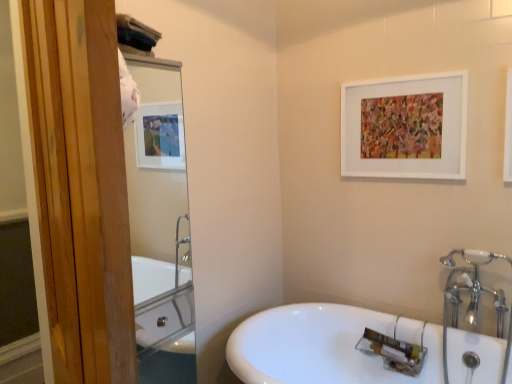
Find the location of a particular element. The height and width of the screenshot is (384, 512). clear glass mirror at upper left is located at coordinates tap(159, 223).

You are a GUI agent. You are given a task and a screenshot of the screen. Output one action in this format:
    pyautogui.click(x=<x>, y=<y>)
    Task: Click on the white matte picture frame at upper center
    The height and width of the screenshot is (384, 512).
    Given the screenshot: What is the action you would take?
    pyautogui.click(x=405, y=127)

Based on the photo, is clear glass mirror at upper left thinner than white glossy sink at lower center?

Yes.

Which is behind, clear glass mirror at upper left or white glossy sink at lower center?

clear glass mirror at upper left is behind.

Which is further, (167, 356) or (296, 353)?

The point (296, 353) is more distant.

In the scene shown: Is clear glass mirror at upper left smaller than white glossy sink at lower center?

Correct, clear glass mirror at upper left occupies less space than white glossy sink at lower center.

Is white glossy sink at lower center in contact with white ceramic faucet at upper right?

No, white glossy sink at lower center is not next to white ceramic faucet at upper right.

Does point (322, 347) lie behind point (471, 316)?

Yes, it is behind point (471, 316).

From the image's perspective, which one is positioned higher, white glossy sink at lower center or white ceramic faucet at upper right?

white ceramic faucet at upper right appears higher in the image.

Would you say white glossy sink at lower center is to the left or to the right of white ceramic faucet at upper right in the picture?

Clearly, white glossy sink at lower center is on the left of white ceramic faucet at upper right in the image.

From a real-world perspective, is white matte picture frame at upper center physically located above or below clear glass mirror at upper left?

From a real-world perspective, white matte picture frame at upper center is physically above clear glass mirror at upper left.

Is white matte picture frame at upper center inside the boundaries of clear glass mirror at upper left, or outside?

white matte picture frame at upper center cannot be found inside clear glass mirror at upper left.

Does white matte picture frame at upper center turn towards clear glass mirror at upper left?

Yes, white matte picture frame at upper center faces towards clear glass mirror at upper left.

Between white ceramic faucet at upper right and white matte picture frame at upper center, which one has larger size?

white ceramic faucet at upper right is bigger.

Can you confirm if white ceramic faucet at upper right is positioned to the left of white matte picture frame at upper center?

Incorrect, white ceramic faucet at upper right is not on the left side of white matte picture frame at upper center.

Is white ceramic faucet at upper right facing away from white matte picture frame at upper center?

No.

From a real-world perspective, is white ceramic faucet at upper right beneath white matte picture frame at upper center?

Yes.

From a real-world perspective, which is physically above, white ceramic faucet at upper right or clear glass mirror at upper left?

clear glass mirror at upper left, from a real-world perspective.

Is white ceramic faucet at upper right located outside clear glass mirror at upper left?

Yes, white ceramic faucet at upper right is located beyond the bounds of clear glass mirror at upper left.

From the image's perspective, is white ceramic faucet at upper right located above or below clear glass mirror at upper left?

white ceramic faucet at upper right is situated lower than clear glass mirror at upper left in the image.

Looking at this image, is there a large distance between white ceramic faucet at upper right and clear glass mirror at upper left?

Yes, white ceramic faucet at upper right and clear glass mirror at upper left are quite far apart.

Does point (148, 194) come closer to viewer compared to point (503, 307)?

No, (148, 194) is behind (503, 307).

How many degrees apart are the facing directions of clear glass mirror at upper left and white ceramic faucet at upper right?

They differ by 88 degrees in their facing directions.

Considering the relative sizes of clear glass mirror at upper left and white ceramic faucet at upper right in the image provided, is clear glass mirror at upper left smaller than white ceramic faucet at upper right?

Actually, clear glass mirror at upper left might be larger than white ceramic faucet at upper right.

Which object is positioned more to the left, clear glass mirror at upper left or white ceramic faucet at upper right?

clear glass mirror at upper left.

Where is `sink below the clear glass mirror at upper left (from a real-world perspective)`? sink below the clear glass mirror at upper left (from a real-world perspective) is located at coordinates (324, 346).

Is white glossy sink at lower center thinner than clear glass mirror at upper left?

Incorrect, the width of white glossy sink at lower center is not less than that of clear glass mirror at upper left.

Is white glossy sink at lower center next to clear glass mirror at upper left and touching it?

white glossy sink at lower center and clear glass mirror at upper left are not in contact.

Can you tell me how much white glossy sink at lower center and clear glass mirror at upper left differ in facing direction?

88 degrees separate the facing orientations of white glossy sink at lower center and clear glass mirror at upper left.

What are the coordinates of `mirror that appears above the white glossy sink at lower center (from the image's perspective)` in the screenshot? It's located at (159, 223).

The width and height of the screenshot is (512, 384). I want to click on sink in front of the white ceramic faucet at upper right, so click(x=324, y=346).

Based on their spatial positions, is white matte picture frame at upper center or white ceramic faucet at upper right closer to clear glass mirror at upper left?

white matte picture frame at upper center.

Considering their positions, is white ceramic faucet at upper right positioned further to white glossy sink at lower center than clear glass mirror at upper left?

The object further to white glossy sink at lower center is clear glass mirror at upper left.

When comparing their distances from white ceramic faucet at upper right, does white matte picture frame at upper center or clear glass mirror at upper left seem further?

clear glass mirror at upper left is further to white ceramic faucet at upper right.

Estimate the real-world distances between objects in this image. Which object is closer to white ceramic faucet at upper right, clear glass mirror at upper left or white glossy sink at lower center?

The object closer to white ceramic faucet at upper right is white glossy sink at lower center.

Based on their spatial positions, is white ceramic faucet at upper right or white matte picture frame at upper center closer to clear glass mirror at upper left?

Among the two, white matte picture frame at upper center is located nearer to clear glass mirror at upper left.

Considering their positions, is clear glass mirror at upper left positioned further to white matte picture frame at upper center than white ceramic faucet at upper right?

Based on the image, clear glass mirror at upper left appears to be further to white matte picture frame at upper center.

Estimate the real-world distances between objects in this image. Which object is further from white matte picture frame at upper center, clear glass mirror at upper left or white glossy sink at lower center?

Among the two, clear glass mirror at upper left is located further to white matte picture frame at upper center.

Which object lies nearer to the anchor point clear glass mirror at upper left, white matte picture frame at upper center or white glossy sink at lower center?

white glossy sink at lower center.

Where is `plumbing fixture between white matte picture frame at upper center and white glossy sink at lower center from top to bottom`? plumbing fixture between white matte picture frame at upper center and white glossy sink at lower center from top to bottom is located at coordinates (472, 287).

Identify the location of picture frame situated between clear glass mirror at upper left and white ceramic faucet at upper right from left to right. (405, 127).

The width and height of the screenshot is (512, 384). I want to click on mirror between white matte picture frame at upper center and white glossy sink at lower center in the vertical direction, so pyautogui.click(x=159, y=223).

At what (x,y) coordinates should I click in order to perform the action: click on sink between clear glass mirror at upper left and white ceramic faucet at upper right in the horizontal direction. Please return your answer as a coordinate pair (x, y). Image resolution: width=512 pixels, height=384 pixels. Looking at the image, I should click on (324, 346).